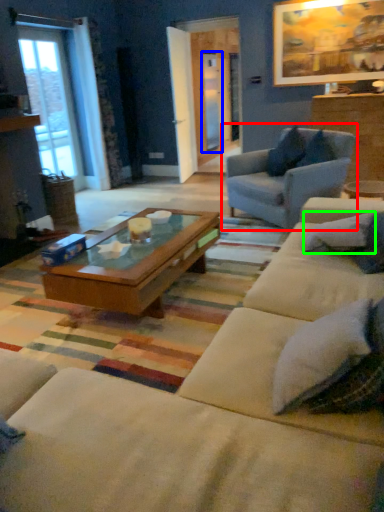
Question: Based on their relative distances, which object is nearer to chair (highlighted by a red box)? Choose from screen door (highlighted by a blue box) and pillow (highlighted by a green box).

Choices:
 (A) screen door
 (B) pillow

Answer: (B)